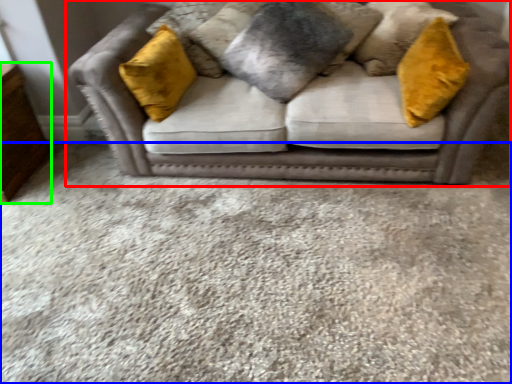
Question: Which is farther away from studio couch (highlighted by a red box)? plain (highlighted by a blue box) or dresser (highlighted by a green box)?

Choices:
 (A) plain
 (B) dresser

Answer: (B)